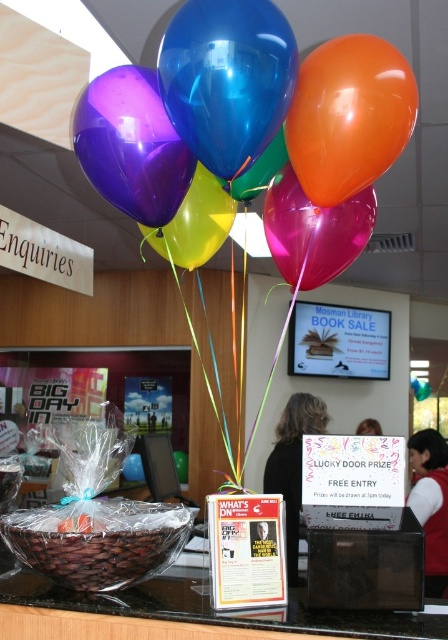
Question: Estimate the real-world distances between objects in this image. Which object is farther from the purple glossy balloon at upper left?

Choices:
 (A) translucent yellow balloon at center
 (B) clear plastic basket at lower left
 (C) glossy latex balloons at upper center
 (D) translucent pink balloon at center

Answer: (C)

Question: Is orange glossy balloon at upper right closer to the viewer compared to translucent pink balloon at center?

Choices:
 (A) yes
 (B) no

Answer: (A)

Question: Estimate the real-world distances between objects in this image. Which object is farther from the glossy latex balloons at upper center?

Choices:
 (A) translucent plastic basket at lower left
 (B) translucent yellow balloon at center
 (C) orange glossy balloon at upper right
 (D) translucent pink balloon at center

Answer: (A)

Question: Does glossy latex balloons at upper center appear over clear plastic basket at lower left?

Choices:
 (A) no
 (B) yes

Answer: (B)

Question: Does orange glossy balloon at upper right appear on the left side of translucent pink balloon at center?

Choices:
 (A) yes
 (B) no

Answer: (B)

Question: Which of the following is the farthest from the observer?

Choices:
 (A) translucent plastic basket at lower left
 (B) orange glossy balloon at upper right
 (C) shiny blue balloon at center

Answer: (B)